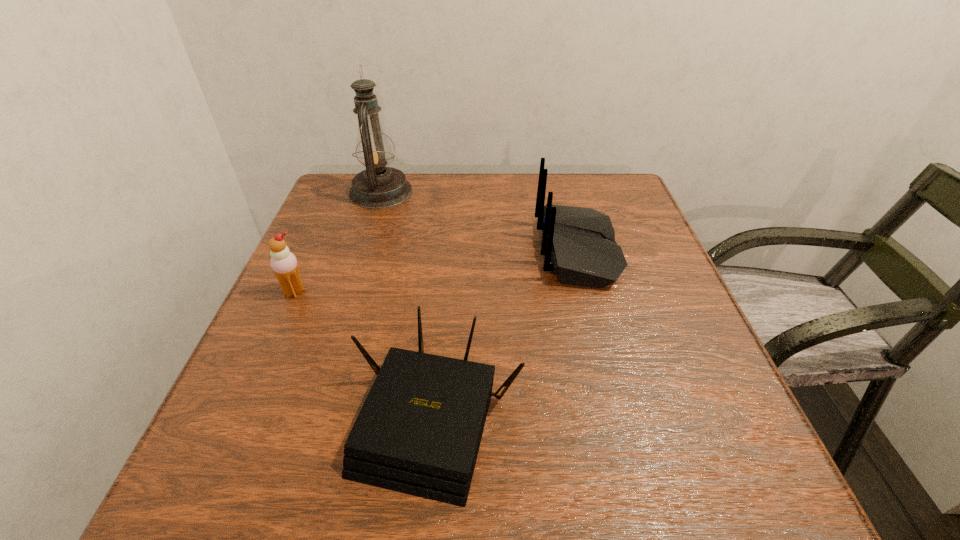
Find the location of a particular element. the second closest object to the nearest object is located at coordinates (284, 264).

Image resolution: width=960 pixels, height=540 pixels. Identify the location of the second closest object to the leftmost object. (377, 187).

You are a GUI agent. You are given a task and a screenshot of the screen. Output one action in this format:
    pyautogui.click(x=<x>, y=<y>)
    Task: Click on the vacant point that satisfies the following two spatial constraints: 1. on the back of the taller router; 2. on the front side of the shorter router
    This screenshot has width=960, height=540.
    Given the screenshot: What is the action you would take?
    pyautogui.click(x=621, y=418)

Find the location of `free space that satisfies the following two spatial constraints: 1. on the front side of the nearest object; 2. on the right side of the farthest object`. free space that satisfies the following two spatial constraints: 1. on the front side of the nearest object; 2. on the right side of the farthest object is located at coordinates (309, 418).